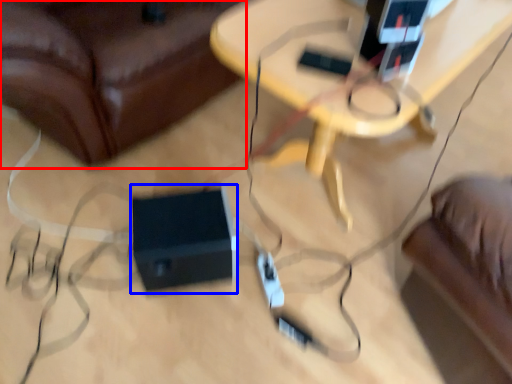
Question: Among these objects, which one is nearest to the camera, furniture (highlighted by a red box) or speaker (highlighted by a blue box)?

Choices:
 (A) furniture
 (B) speaker

Answer: (A)